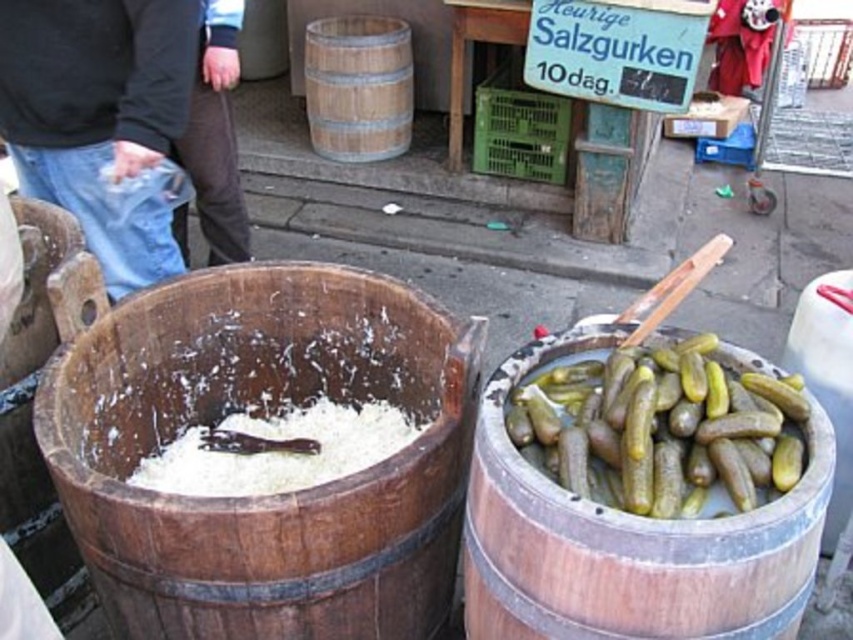
Does wooden barrel at center appear on the left side of brown leather pants at center?

In fact, wooden barrel at center is to the right of brown leather pants at center.

Which is above, wooden barrel at center or brown leather pants at center?

Positioned higher is brown leather pants at center.

Is point (144, 388) less distant than point (241, 209)?

Yes.

At what (x,y) coordinates should I click in order to perform the action: click on wooden barrel at center. Please return your answer as a coordinate pair (x, y). Looking at the image, I should click on point(270,496).

Is wooden barrel at upper center below brown leather pants at center?

No.

Does wooden barrel at upper center have a lesser height compared to brown leather pants at center?

Indeed, wooden barrel at upper center has a lesser height compared to brown leather pants at center.

Who is more forward, (312, 116) or (198, 145)?

Point (198, 145) is in front.

You are a GUI agent. You are given a task and a screenshot of the screen. Output one action in this format:
    pyautogui.click(x=<x>, y=<y>)
    Task: Click on the wooden barrel at upper center
    This screenshot has height=640, width=853.
    Given the screenshot: What is the action you would take?
    point(358,86)

Who is positioned more to the right, wooden barrel at right or brown leather pants at center?

wooden barrel at right is more to the right.

Is wooden barrel at right positioned in front of brown leather pants at center?

Yes, wooden barrel at right is closer to the viewer.

Where is `wooden barrel at right`? The height and width of the screenshot is (640, 853). wooden barrel at right is located at coordinates (627, 540).